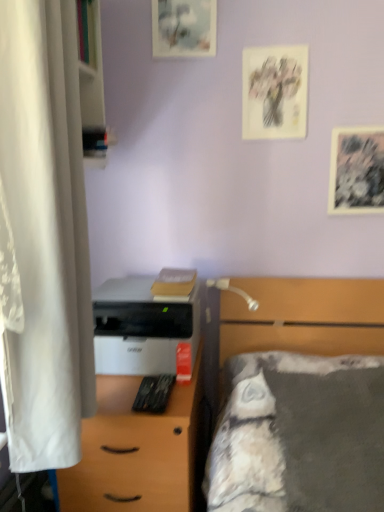
Question: Considering the relative sizes of white matte printer at center and gray fabric bed at right in the image provided, is white matte printer at center smaller than gray fabric bed at right?

Choices:
 (A) yes
 (B) no

Answer: (A)

Question: Can you confirm if white matte printer at center is thinner than gray fabric bed at right?

Choices:
 (A) yes
 (B) no

Answer: (B)

Question: Is white matte printer at center at the right side of gray fabric bed at right?

Choices:
 (A) no
 (B) yes

Answer: (A)

Question: Is white matte printer at center positioned before gray fabric bed at right?

Choices:
 (A) no
 (B) yes

Answer: (A)

Question: Does white matte printer at center contain gray fabric bed at right?

Choices:
 (A) no
 (B) yes

Answer: (A)

Question: From the image's perspective, does white matte printer at center appear lower than gray fabric bed at right?

Choices:
 (A) no
 (B) yes

Answer: (A)

Question: Is white wood bookshelf at left surrounded by matte paper picture frame at upper center, marked as the first picture frame in a left-to-right arrangement?

Choices:
 (A) yes
 (B) no

Answer: (B)

Question: Is matte paper picture frame at upper center, marked as the third picture frame in a right-to-left arrangement, thinner than white wood bookshelf at left?

Choices:
 (A) no
 (B) yes

Answer: (B)

Question: Considering the relative sizes of matte paper picture frame at upper center, positioned as the 1th picture frame in top-to-bottom order, and white wood bookshelf at left in the image provided, is matte paper picture frame at upper center, positioned as the 1th picture frame in top-to-bottom order, shorter than white wood bookshelf at left?

Choices:
 (A) no
 (B) yes

Answer: (B)

Question: Is matte paper picture frame at upper center, positioned as the 1th picture frame in top-to-bottom order, positioned before white wood bookshelf at left?

Choices:
 (A) yes
 (B) no

Answer: (B)

Question: From the image's perspective, would you say matte paper picture frame at upper center, the third picture frame ordered from the bottom, is positioned over white wood bookshelf at left?

Choices:
 (A) no
 (B) yes

Answer: (B)

Question: Does matte paper picture frame at upper center, the third picture frame ordered from the bottom, have a greater width compared to white wood bookshelf at left?

Choices:
 (A) yes
 (B) no

Answer: (B)

Question: Considering the relative positions of white matte desk at center and white wood bookshelf at left in the image provided, is white matte desk at center to the right of white wood bookshelf at left from the viewer's perspective?

Choices:
 (A) yes
 (B) no

Answer: (A)